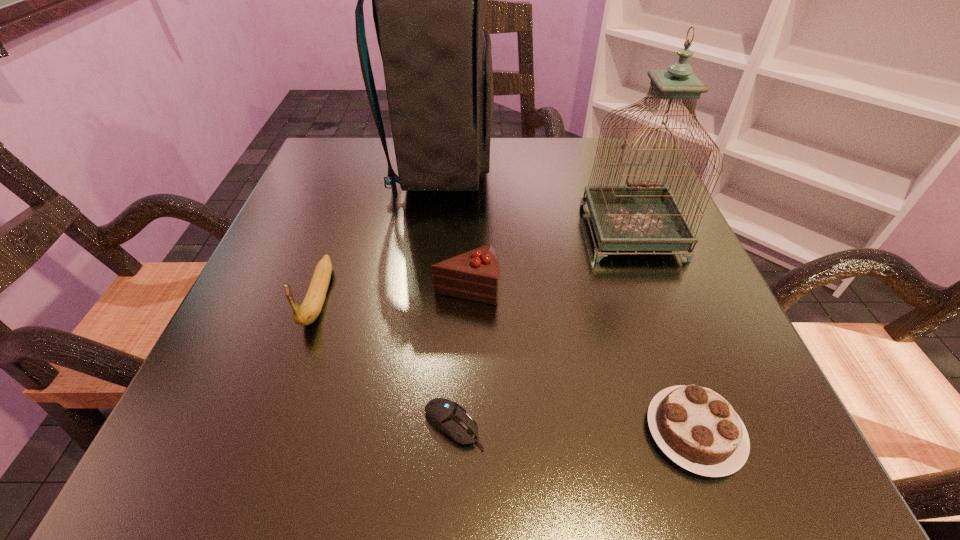
The width and height of the screenshot is (960, 540). In order to click on chocolate cake at the right edge in this screenshot , I will do `click(698, 429)`.

Where is `object that is at the near right corner`? object that is at the near right corner is located at coordinates (698, 429).

You are a GUI agent. You are given a task and a screenshot of the screen. Output one action in this format:
    pyautogui.click(x=<x>, y=<y>)
    Task: Click on the vacant space at the far edge of the desktop
    
    Given the screenshot: What is the action you would take?
    pyautogui.click(x=516, y=165)

Find the location of `free space at the near edge of the desktop`. free space at the near edge of the desktop is located at coordinates (367, 454).

At what (x,y) coordinates should I click in order to perform the action: click on vacant space at the left edge of the desktop. Please return your answer as a coordinate pair (x, y). The width and height of the screenshot is (960, 540). Looking at the image, I should click on pos(252,296).

The width and height of the screenshot is (960, 540). Find the location of `vacant position at the right edge of the desktop`. vacant position at the right edge of the desktop is located at coordinates (690, 325).

Find the location of a particular element. This screenshot has width=960, height=540. blank space at the far left corner of the desktop is located at coordinates (380, 171).

Find the location of `empty location between the backpack and the computer mouse`. empty location between the backpack and the computer mouse is located at coordinates (447, 297).

The width and height of the screenshot is (960, 540). In order to click on free area in between the fourth shortest object and the computer mouse in this screenshot , I will do click(386, 362).

Where is `vacant area that lies between the nearer chocolate cake and the birdcage`? vacant area that lies between the nearer chocolate cake and the birdcage is located at coordinates (662, 332).